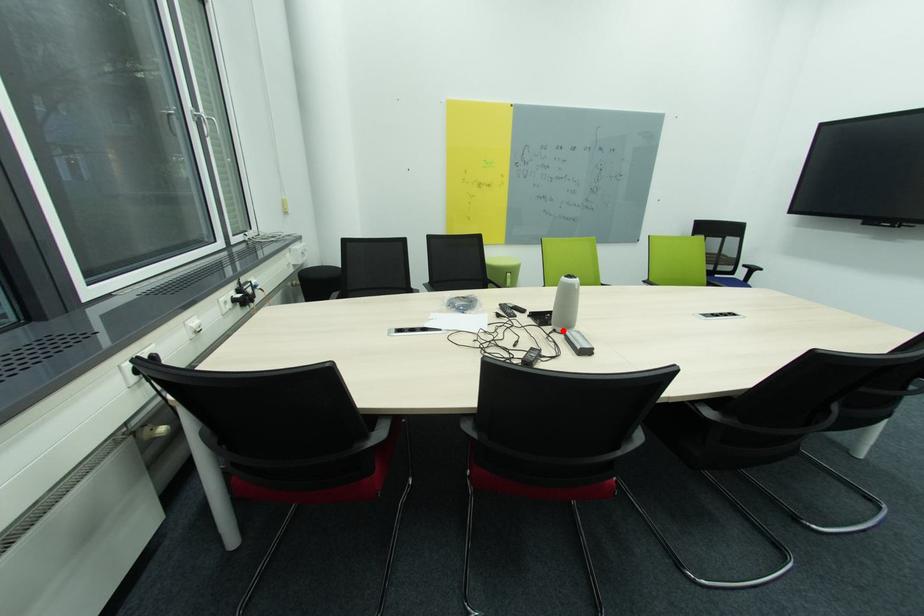
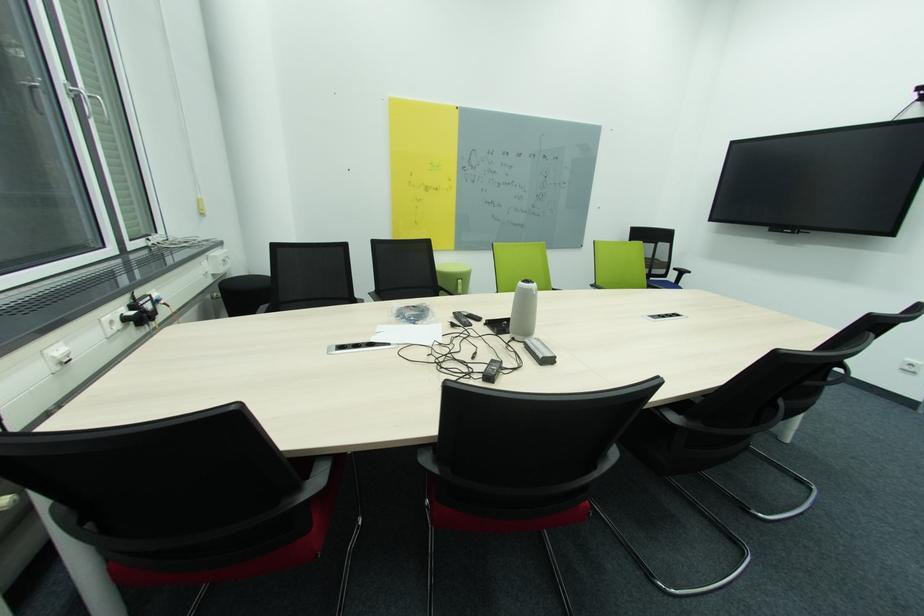
The point at the highlighted location is marked in the first image. Where is the corresponding point in the second image?

(521, 339)